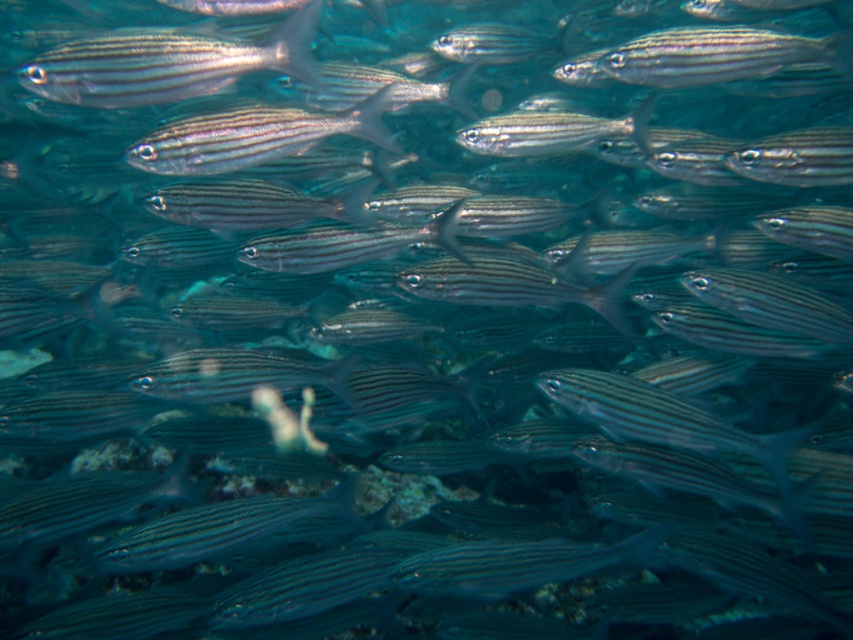
You are a marine biologist observing the school of fish underwater. You notice two points marked in the scene. Which point is closer to you, point (271, 32) or point (219, 150)?

Point (271, 32) is closer to the viewer than point (219, 150).

In the scene shown: You are a marine biologist observing the school of fish. You notice the shiny silver fish at upper left and the silvery striped fish at center. Which one is closer to the surface of the water?

The shiny silver fish at upper left is closer to the surface of the water because it is in front of the silvery striped fish at center, which implies it is positioned higher in the water column.